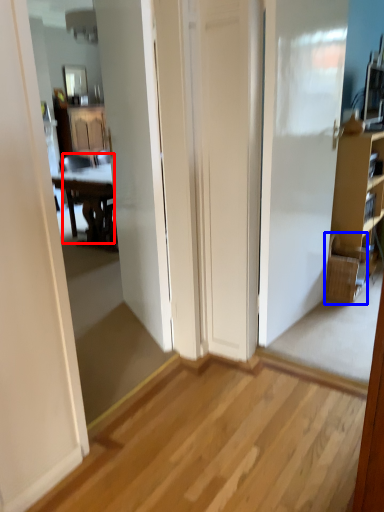
Question: Which object is further to the camera taking this photo, chair (highlighted by a red box) or picnic basket (highlighted by a blue box)?

Choices:
 (A) chair
 (B) picnic basket

Answer: (A)